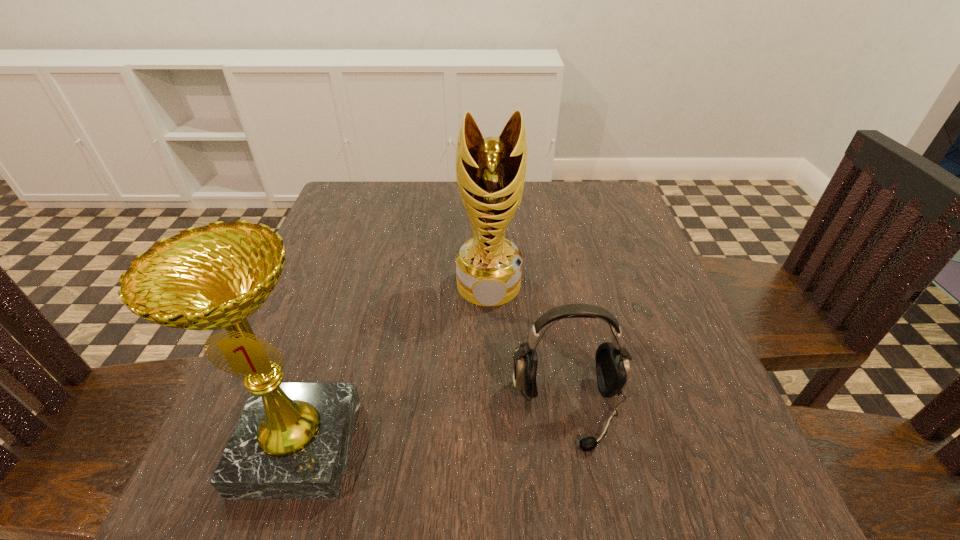
At what (x,y) coordinates should I click in order to perform the action: click on empty space between the left award and the headset. Please return your answer as a coordinate pair (x, y). The image size is (960, 540). Looking at the image, I should click on (433, 428).

Identify the location of vacant point located between the shortest object and the nearer award. (433, 428).

At what (x,y) coordinates should I click in order to perform the action: click on empty space that is in between the leftmost object and the shortest object. Please return your answer as a coordinate pair (x, y). This screenshot has height=540, width=960. Looking at the image, I should click on (433, 428).

Find the location of a particular element. Image resolution: width=960 pixels, height=540 pixels. free space between the right award and the leftmost object is located at coordinates (394, 366).

Find the location of a particular element. The width and height of the screenshot is (960, 540). empty space between the left award and the headset is located at coordinates (433, 428).

The width and height of the screenshot is (960, 540). In order to click on empty location between the left award and the shortest object in this screenshot , I will do `click(433, 428)`.

The height and width of the screenshot is (540, 960). I want to click on free space between the left award and the headset, so click(x=433, y=428).

Find the location of a particular element. vacant space in between the shortest object and the left award is located at coordinates (433, 428).

At what (x,y) coordinates should I click in order to perform the action: click on object that is the second closest to the nearer award. Please return your answer as a coordinate pair (x, y). The height and width of the screenshot is (540, 960). Looking at the image, I should click on (491, 172).

I want to click on object that ranks as the second closest to the farthest object, so click(291, 442).